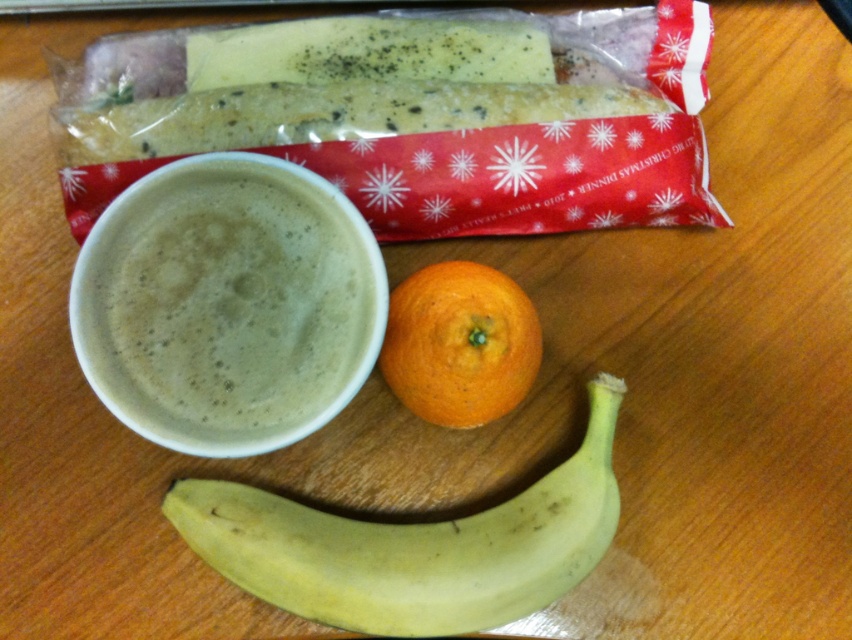
You are planning to serve the orangesmoothfruit at center and the green frothy dip at upper left at a party. Based on their positions, which item is placed higher up?

The green frothy dip at upper left is positioned over orangesmoothfruit at center, so it is placed higher up.

You are a food stylist arranging items on a table. You have a green frothy dip at upper left and a green matte banana at lower center. Which item takes up more space on the table?

The green matte banana at lower center takes up more space on the table because it is larger than the green frothy dip at upper left.

You are arranging a picnic basket and need to place the green frothy dip at upper left and the green matte banana at lower center into it. Since the dip might spill, you want to place the banana in a position where it won

The green frothy dip at upper left is closer to the viewer than the green matte banana at lower center, so you should place the green matte banana at lower center underneath the green frothy dip at upper left to prevent spilling.